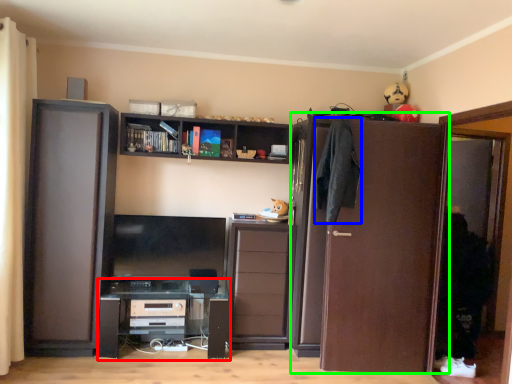
Question: Which is farther away from computer desk (highlighted by a red box)? clothing (highlighted by a blue box) or door (highlighted by a green box)?

Choices:
 (A) clothing
 (B) door

Answer: (A)